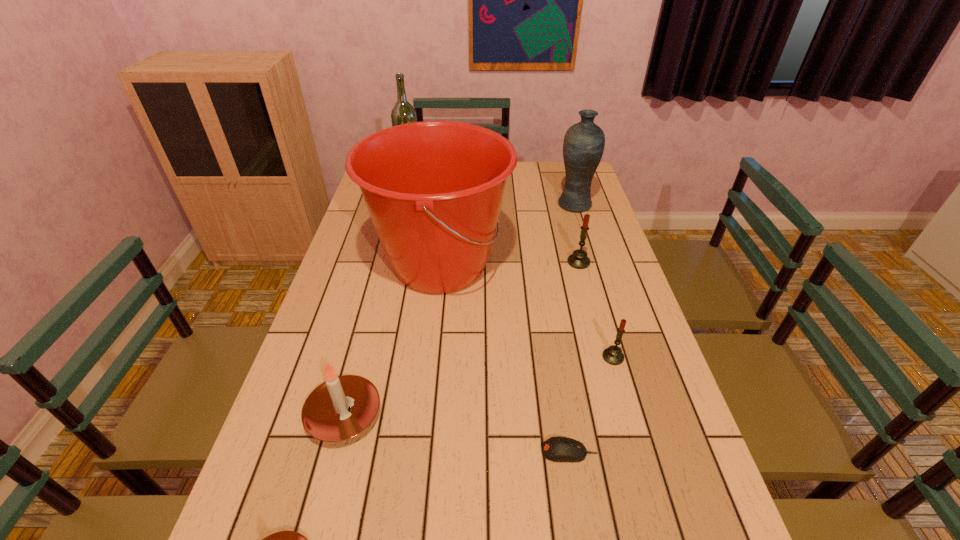
Locate an element on the screen. The width and height of the screenshot is (960, 540). object present at the far edge is located at coordinates (403, 112).

You are a GUI agent. You are given a task and a screenshot of the screen. Output one action in this format:
    pyautogui.click(x=<x>, y=<y>)
    Task: Click on the liquor situated at the left edge
    
    Given the screenshot: What is the action you would take?
    pyautogui.click(x=403, y=112)

Identify the location of bucket that is at the left edge. The width and height of the screenshot is (960, 540). (434, 189).

Where is `candle that is at the left edge`? The height and width of the screenshot is (540, 960). candle that is at the left edge is located at coordinates [x=340, y=408].

This screenshot has width=960, height=540. Find the location of `vase located in the right edge section of the desktop`. vase located in the right edge section of the desktop is located at coordinates (x=584, y=142).

Find the location of a particular element. The width and height of the screenshot is (960, 540). object at the far left corner is located at coordinates (403, 112).

You are a GUI agent. You are given a task and a screenshot of the screen. Output one action in this format:
    pyautogui.click(x=<x>, y=<y>)
    Task: Click on the free space at the left edge of the desktop
    This screenshot has width=960, height=540.
    Given the screenshot: What is the action you would take?
    pyautogui.click(x=360, y=299)

Identify the location of vacant position at the right edge of the desktop. This screenshot has width=960, height=540. (612, 301).

Where is `vacant space at the far right corner of the desktop`? The width and height of the screenshot is (960, 540). vacant space at the far right corner of the desktop is located at coordinates (561, 180).

In order to click on vacant space that is in between the bigger red candle and the blue vase in this screenshot , I will do coord(577,233).